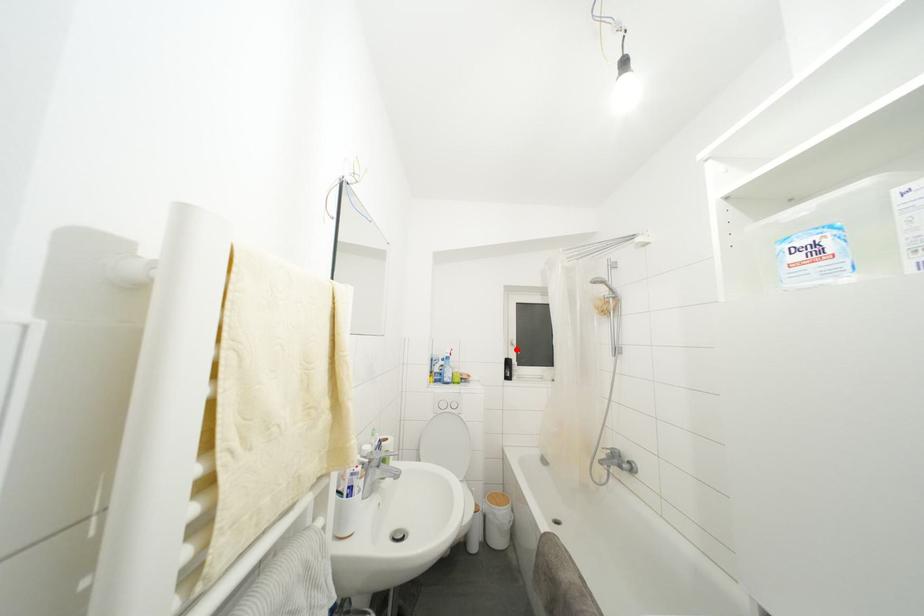
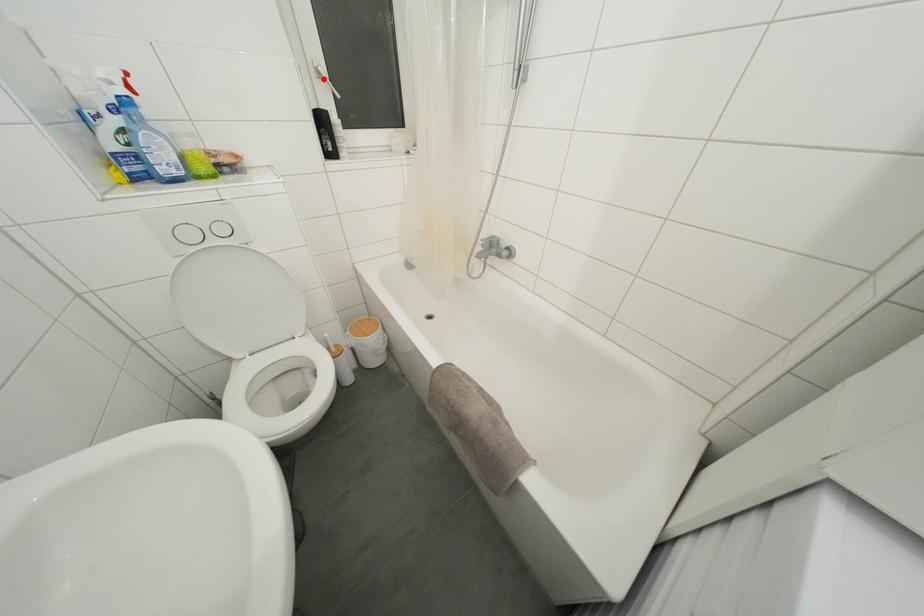
I am providing you with two images of the same scene from different viewpoints. A red point is marked on the first image and another point is marked on the second image. Does the point marked in image1 correspond to the same location as the one in image2?

Yes